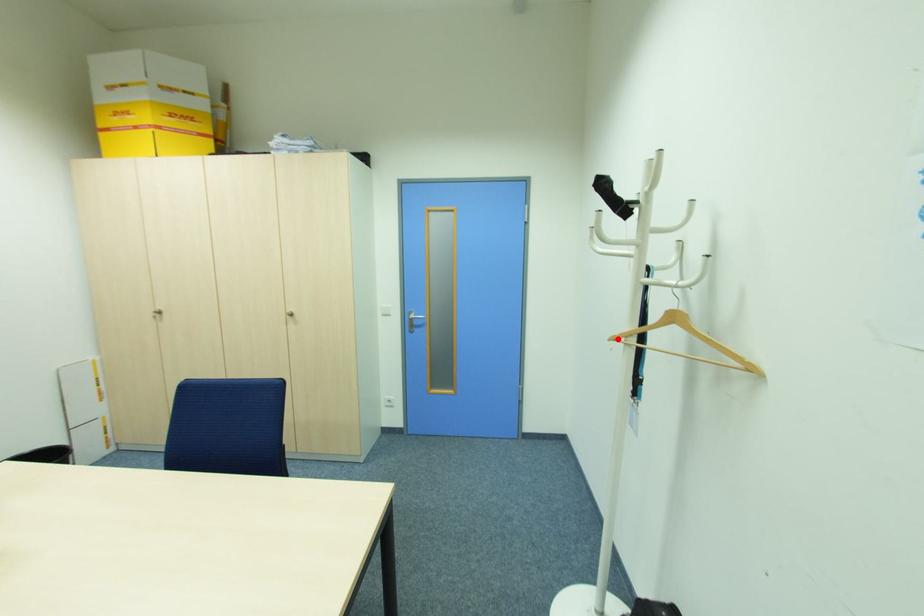
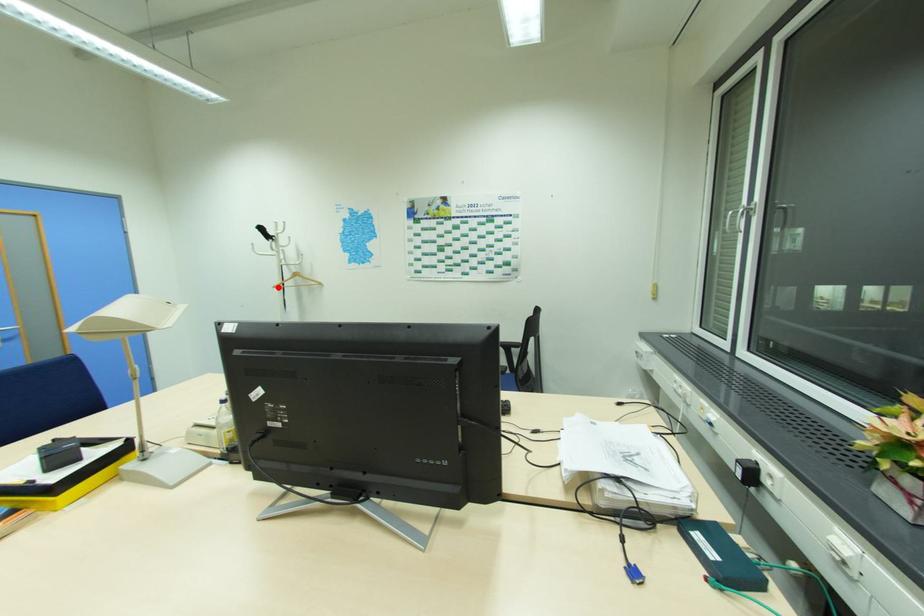
I am providing you with two images of the same scene from different viewpoints. A red point is marked on the first image and another point is marked on the second image. Are the points marked in image1 and image2 representing the same 3D position?

Answer: Yes